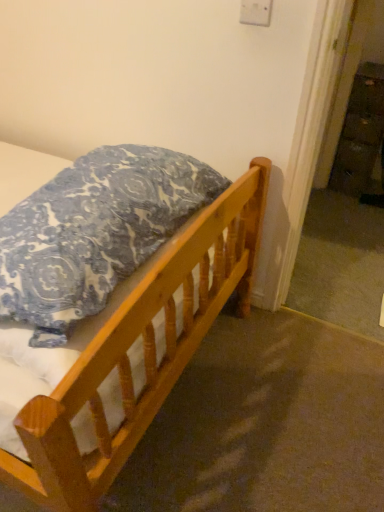
At what (x,y) coordinates should I click in order to perform the action: click on free space in front of wooden dresser at right. Please return your answer as a coordinate pair (x, y). This screenshot has height=512, width=384. Looking at the image, I should click on (345, 201).